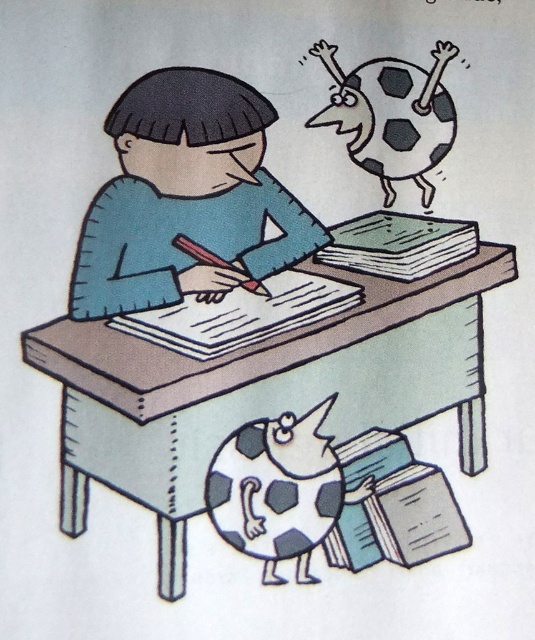
You are a toy designer trying to create a new toy that can fit on the light brown wooden table at center without blocking the black and white spotted figure at upper right. Based on their sizes, can you place the toy on the table without it interfering with the figure?

The light brown wooden table at center is taller than the black and white spotted figure at upper right, so placing the toy on the table would not interfere with the figure since the table is elevated higher.

You are an AI analyzing the position of objects in the image. The scene shows a child at a desk with a notebook and a soccer ball character. Where is the blue matte shirt at center located in terms of coordinates?

The blue matte shirt at center is located at coordinates point (186, 196).

What is the relationship between the light brown wooden table at center and the black and white spotted figure at upper right in terms of their vertical positioning?

The light brown wooden table at center is positioned under the black and white spotted figure at upper right, meaning the table is below and the figure is above in the vertical plane.